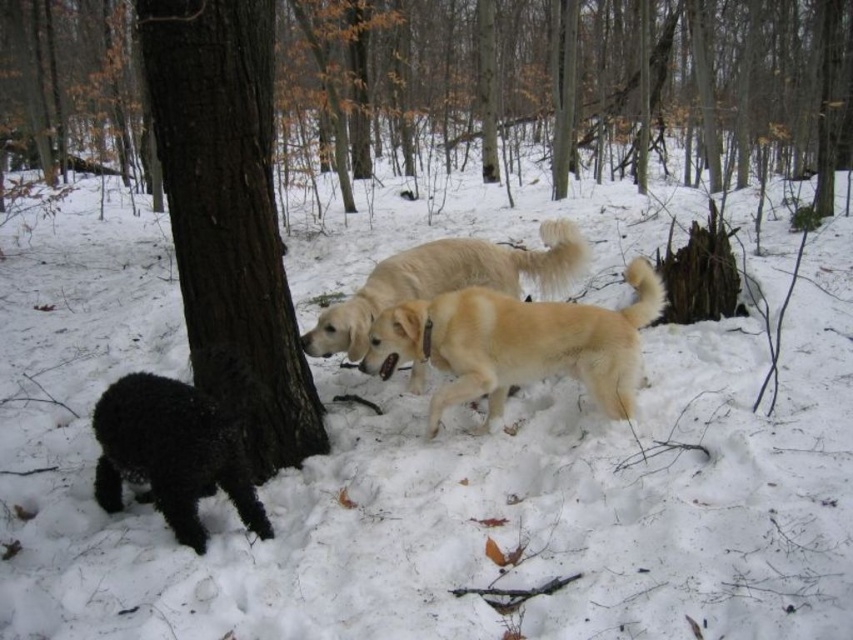
You are a hiker who just arrived at this winter forest scene. You need to locate the dark brown bark at center. Where should you look?

The dark brown bark at center is located at coordinates point (x=229, y=214).

You are planning to hang a small birdhouse on the brown rough tree trunk at center. Considering the size of the shiny black dog at lower left, do you think the tree trunk is large enough to support the birdhouse without the dog damaging it?

The brown rough tree trunk at center has a larger size compared to shiny black dog at lower left. Since the tree trunk is bigger, it should be sturdy enough to support the birdhouse and withstand any potential damage from the dog.

You are a hiker in the forest and see the golden fur dog at center and the light golden fur at center. Which one is thinner?

The golden fur dog at center is thinner than the light golden fur at center.